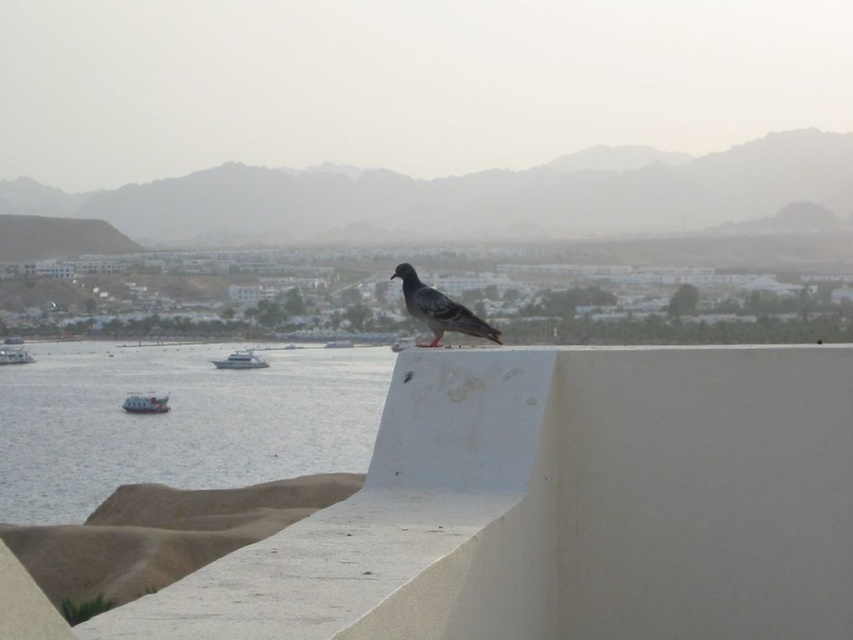
Question: Does gray matte pigeon at center have a smaller size compared to metallic gray boat at lower left?

Choices:
 (A) yes
 (B) no

Answer: (B)

Question: Which point is farther to the camera?

Choices:
 (A) (155, 444)
 (B) (412, 292)
 (C) (28, 356)
 (D) (231, 364)

Answer: (C)

Question: Where is gray matte pigeon at center located in relation to white plastic boat at lower left in the image?

Choices:
 (A) left
 (B) right

Answer: (B)

Question: Which point is farther to the camera?

Choices:
 (A) (318, 416)
 (B) (13, 358)
 (C) (151, 397)

Answer: (B)

Question: From the image, what is the correct spatial relationship of blue water at lower left in relation to white glossy boat at center?

Choices:
 (A) below
 (B) above

Answer: (A)

Question: Among these objects, which one is nearest to the camera?

Choices:
 (A) metallic gray boat at lower left
 (B) white glossy boat at center

Answer: (A)